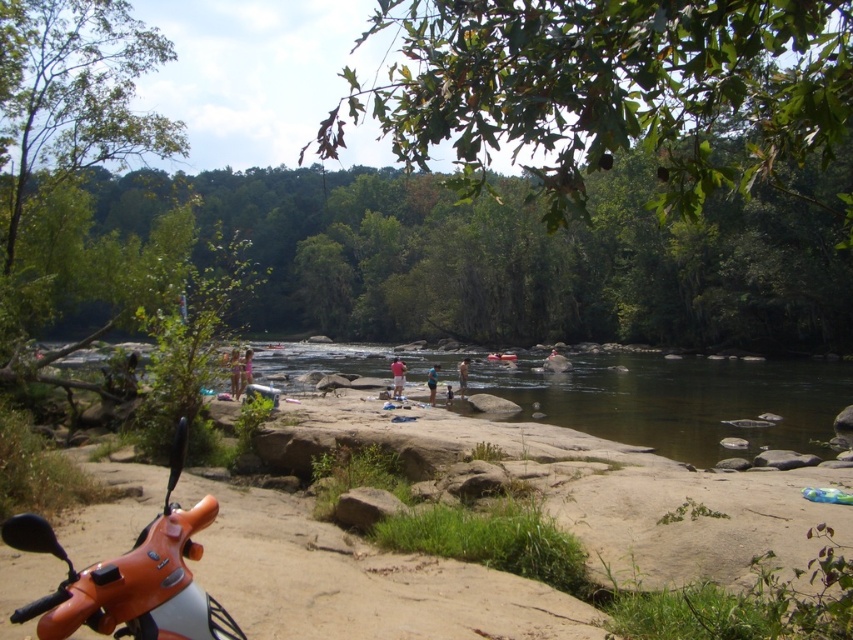
Question: Is orange matte/metallic motorcycle at lower left to the right of blue fabric shirt at center from the viewer's perspective?

Choices:
 (A) no
 (B) yes

Answer: (A)

Question: Which of these objects is positioned closest to the orange matte/metallic motorcycle at lower left?

Choices:
 (A) tan fabric shorts at center
 (B) blue fabric shirt at center

Answer: (B)

Question: Which of the following is the closest to the observer?

Choices:
 (A) blue fabric shirt at center
 (B) tan fabric shorts at center
 (C) orange matte/metallic motorcycle at lower left
 (D) tan cotton shirt at center

Answer: (C)

Question: Is orange matte/metallic motorcycle at lower left wider than tan cotton shirt at center?

Choices:
 (A) no
 (B) yes

Answer: (A)

Question: Can you confirm if orange matte/metallic motorcycle at lower left is positioned below blue fabric shirt at center?

Choices:
 (A) yes
 (B) no

Answer: (B)

Question: Estimate the real-world distances between objects in this image. Which object is farther from the tan cotton shirt at center?

Choices:
 (A) orange matte/metallic motorcycle at lower left
 (B) blue fabric shirt at center
 (C) tan fabric shorts at center

Answer: (A)